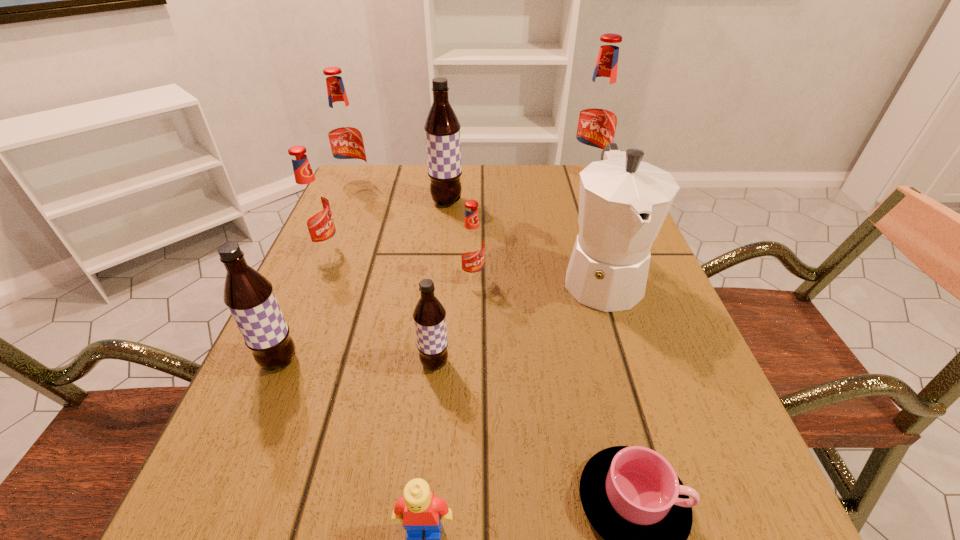
Where is `the tallest object`? The image size is (960, 540). the tallest object is located at coordinates (597, 119).

At what (x,y) coordinates should I click in order to perform the action: click on the rightmost root beer. Please return your answer as a coordinate pair (x, y). The height and width of the screenshot is (540, 960). Looking at the image, I should click on (597, 119).

Locate an element on the screen. the third smallest red root beer is located at coordinates (345, 137).

This screenshot has width=960, height=540. I want to click on the farthest brown root beer, so click(442, 129).

Locate an element on the screen. gray coffeepot is located at coordinates (623, 202).

At what (x,y) coordinates should I click in order to perform the action: click on the fourth farthest root beer. Please return your answer as a coordinate pair (x, y). This screenshot has height=540, width=960. Looking at the image, I should click on (311, 203).

The height and width of the screenshot is (540, 960). In order to click on the third farthest red root beer in this screenshot , I will do `click(311, 203)`.

Locate an element on the screen. The image size is (960, 540). the leftmost brown root beer is located at coordinates (249, 296).

The image size is (960, 540). What are the coordinates of `the smallest brown root beer` in the screenshot? It's located at (429, 315).

Find the location of a particular element. The image size is (960, 540). the fifth farthest root beer is located at coordinates (471, 245).